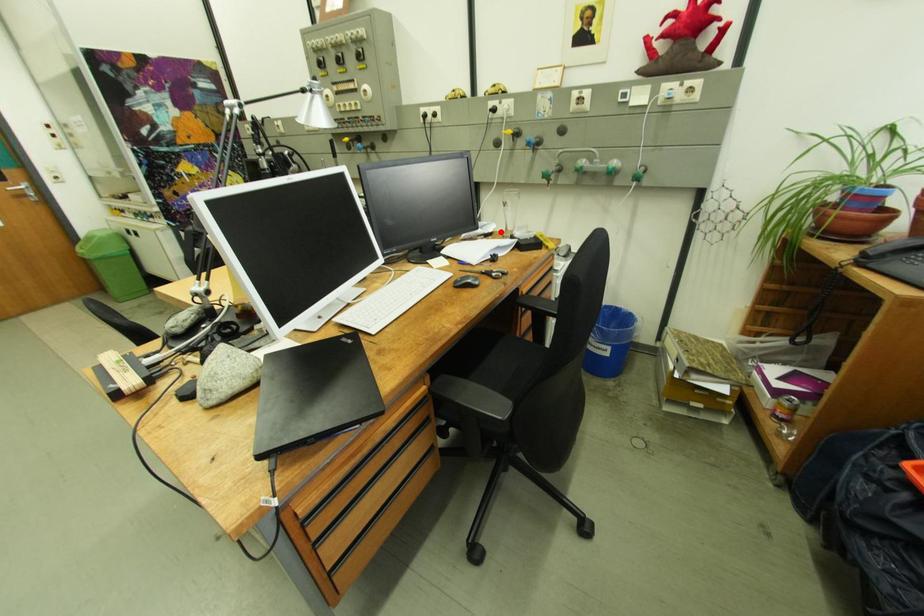
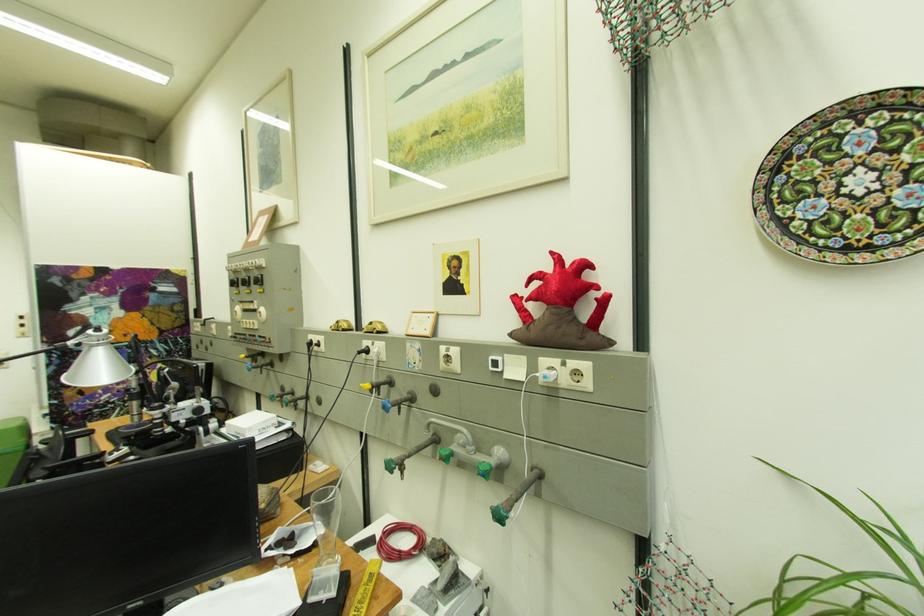
Locate, in the second image, the point that corresponds to the highlighted location in the first image.

(320, 545)